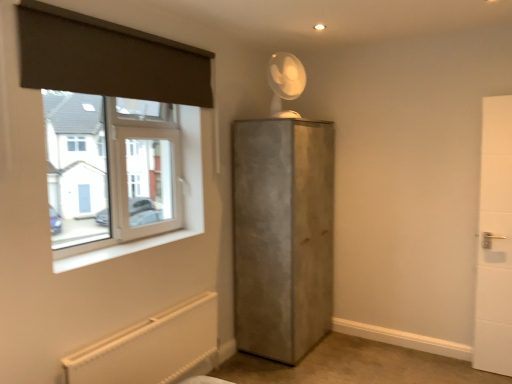
Question: From a real-world perspective, relative to white textured radiator at lower left, is white smooth window sill at lower left vertically above or below?

Choices:
 (A) below
 (B) above

Answer: (B)

Question: Would you say white smooth window sill at lower left is to the left or to the right of white textured radiator at lower left in the picture?

Choices:
 (A) right
 (B) left

Answer: (B)

Question: Estimate the real-world distances between objects in this image. Which object is farther from the white plastic window at upper left?

Choices:
 (A) transparent plastic fan at upper center
 (B) white textured radiator at lower left
 (C) dark gray fabric at upper left
 (D) concrete cabinet at center, acting as the first door starting from the left
 (E) white smooth window sill at lower left

Answer: (A)

Question: Considering the real-world distances, which object is farthest from the white tile door at right, which is the 2th door from left to right?

Choices:
 (A) dark gray fabric at upper left
 (B) white textured radiator at lower left
 (C) white smooth window sill at lower left
 (D) white plastic window at upper left
 (E) transparent plastic fan at upper center

Answer: (D)